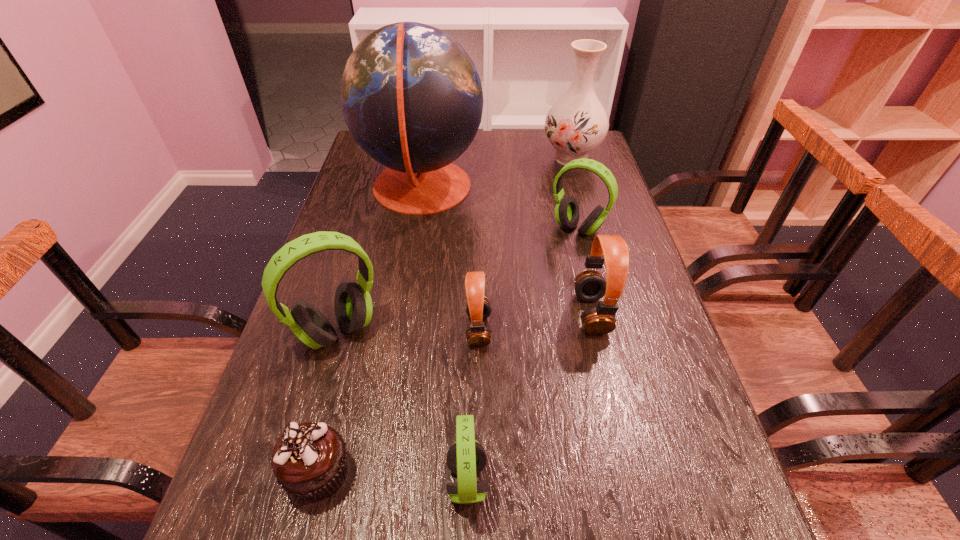
This screenshot has width=960, height=540. I want to click on globe, so click(411, 96).

This screenshot has width=960, height=540. What are the coordinates of `the second tallest object` in the screenshot? It's located at (577, 123).

Locate an element on the screen. The height and width of the screenshot is (540, 960). the second nearest green headset is located at coordinates (353, 307).

Identify the location of the biggest green headset. (353, 307).

I want to click on the right brown headset, so (590, 285).

Identify the location of the farthest green headset. The width and height of the screenshot is (960, 540). (567, 212).

You are a GUI agent. You are given a task and a screenshot of the screen. Output one action in this format:
    pyautogui.click(x=<x>, y=<y>)
    Task: Click on the farthest headset
    The image size is (960, 540).
    Given the screenshot: What is the action you would take?
    [x=567, y=212]

Locate an element on the screen. the left brown headset is located at coordinates (478, 308).

Find the location of a particular element. This screenshot has height=540, width=960. the nearest green headset is located at coordinates (466, 458).

Where is `the smallest green headset`? the smallest green headset is located at coordinates (466, 458).